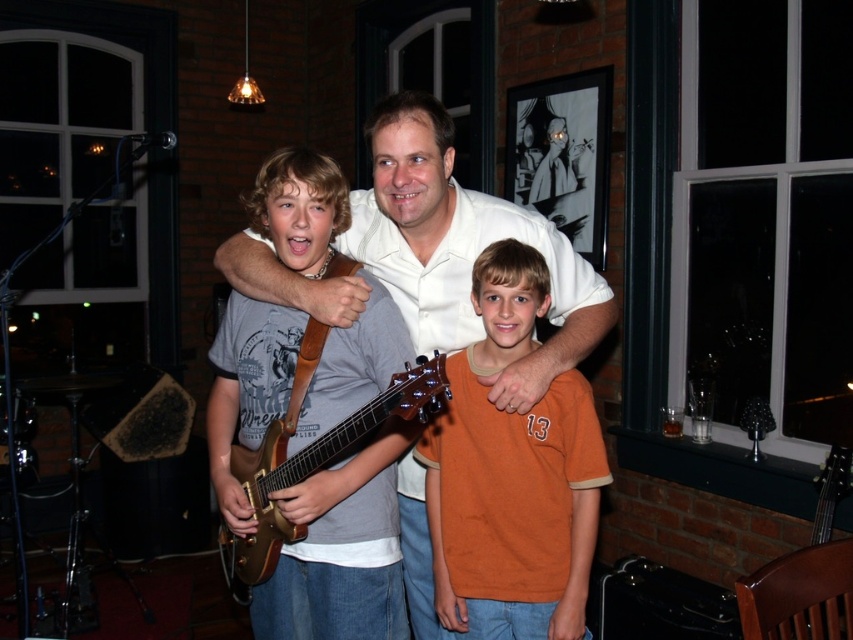
You are a photographer standing at the back of the venue. You want to take a photo that includes both the white smooth shirt at center and the gold metallic guitar at center. Given that your camera has a maximum focus range of 30 centimeters, will you be able to capture both subjects in focus without moving closer?

The white smooth shirt at center and gold metallic guitar at center are 35.84 centimeters apart. Since the distance between them exceeds the camera maximum focus range of 30 centimeters, you will not be able to capture both subjects in focus without moving closer.

You are standing at the origin of the coordinate system in the image. You want to move towards the point at (236,451). Will you pass by the point at (453,259) before reaching your destination?

Point (453,259) is behind point (236,451), so you will not pass by it before reaching your destination.

Consider the image. You are a photographer standing at the back of the venue. You want to take a photo of the two people wearing the orange cotton shirt at center and the white smooth shirt at center. The minimum distance your camera can focus clearly is 10 inches. Will the camera be able to capture both subjects in focus?

The orange cotton shirt at center is 9.73 inches away from the white smooth shirt at center. Since the minimum focus distance is 10 inches, the camera cannot capture both subjects in focus as they are closer than the required distance.